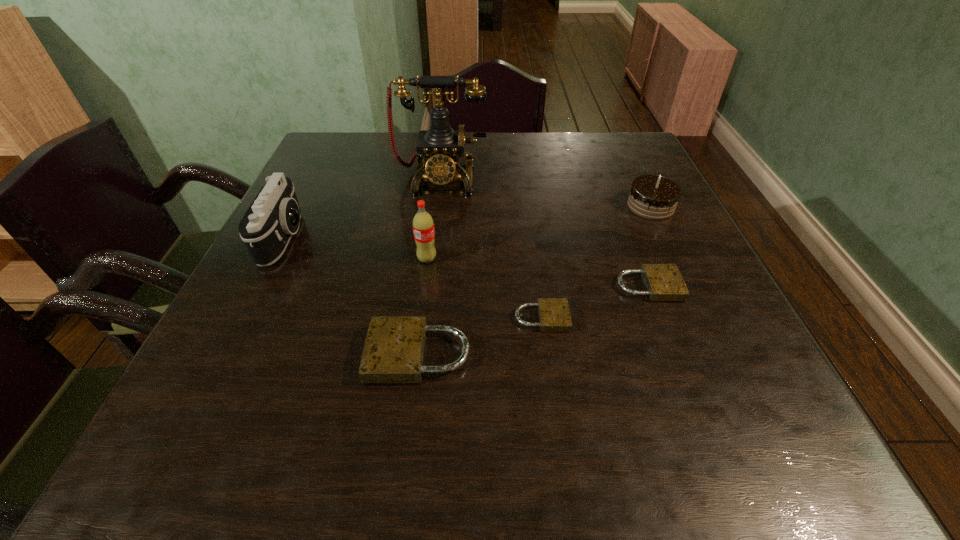
In order to click on the third shortest object in this screenshot , I will do `click(394, 348)`.

I want to click on the leftmost padlock, so click(394, 348).

Identify the location of the shortest object. (554, 315).

You are a GUI agent. You are given a task and a screenshot of the screen. Output one action in this format:
    pyautogui.click(x=<x>, y=<y>)
    Task: Click on the second padlock from left to right
    This screenshot has width=960, height=540.
    Given the screenshot: What is the action you would take?
    pyautogui.click(x=554, y=315)

This screenshot has height=540, width=960. I want to click on the rightmost padlock, so click(x=663, y=282).

The height and width of the screenshot is (540, 960). I want to click on the farthest padlock, so click(663, 282).

Where is `telephone`? telephone is located at coordinates (439, 149).

Locate an element on the screen. Image resolution: width=960 pixels, height=540 pixels. the leftmost object is located at coordinates (274, 216).

Identify the location of soda. (423, 225).

Where is `chocolate cake`? The image size is (960, 540). chocolate cake is located at coordinates pyautogui.click(x=653, y=197).